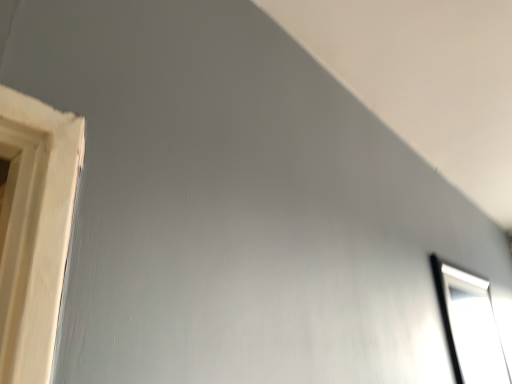
Question: Should I look upward or downward to see black glass window at upper right?

Choices:
 (A) up
 (B) down

Answer: (B)